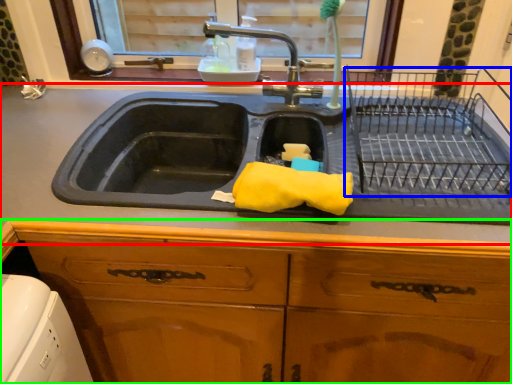
Question: Estimate the real-world distances between objects in this image. Which object is closer to countertop (highlighted by a red box), cage (highlighted by a blue box) or cabinetry (highlighted by a green box)?

Choices:
 (A) cage
 (B) cabinetry

Answer: (B)